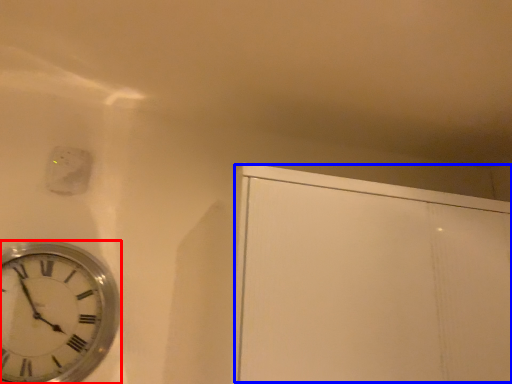
Question: Which point is further to the camera, wall clock (highlighted by a red box) or glass door (highlighted by a blue box)?

Choices:
 (A) wall clock
 (B) glass door

Answer: (A)